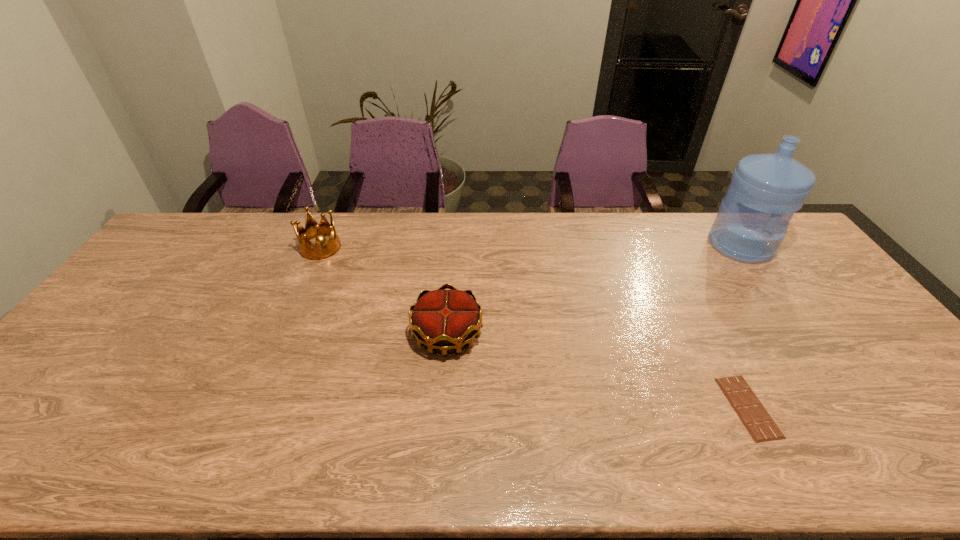
Locate an element on the screen. Image resolution: width=960 pixels, height=540 pixels. the tallest object is located at coordinates [x=765, y=191].

You are a GUI agent. You are given a task and a screenshot of the screen. Output one action in this format:
    pyautogui.click(x=<x>, y=<y>)
    Task: Click on the rightmost object
    
    Given the screenshot: What is the action you would take?
    pyautogui.click(x=765, y=191)

You are a GUI agent. You are given a task and a screenshot of the screen. Output one action in this format:
    pyautogui.click(x=<x>, y=<y>)
    Task: Click on the leftmost object
    
    Given the screenshot: What is the action you would take?
    pyautogui.click(x=323, y=249)

I want to click on the taller crown, so click(x=323, y=249).

Where is `the shorter crown`? the shorter crown is located at coordinates (441, 319).

Where is `the nearer crown`? This screenshot has height=540, width=960. the nearer crown is located at coordinates (441, 319).

Find the location of a particular element. the second object from right to left is located at coordinates (754, 416).

Locate an element on the screen. chocolate bar is located at coordinates (754, 416).

Locate an element on the screen. The width and height of the screenshot is (960, 540). vacant position located 0.120m on the side of the rightmost object with the handle is located at coordinates (773, 291).

Find the location of `vacant area situated 0.360m on the left of the leftmost object`. vacant area situated 0.360m on the left of the leftmost object is located at coordinates (195, 247).